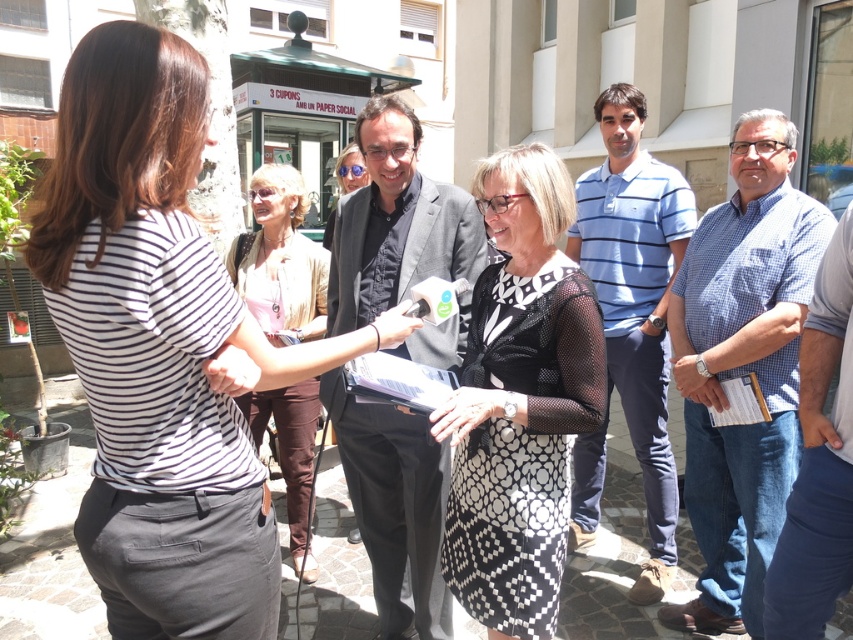
Can you confirm if striped cotton shirt at center is shorter than blue checkered shirt at center?

Yes, striped cotton shirt at center is shorter than blue checkered shirt at center.

The width and height of the screenshot is (853, 640). I want to click on striped cotton shirt at center, so click(x=161, y=348).

The width and height of the screenshot is (853, 640). What do you see at coordinates (161, 348) in the screenshot?
I see `striped cotton shirt at center` at bounding box center [161, 348].

Locate an element on the screen. This screenshot has width=853, height=640. striped cotton shirt at center is located at coordinates (161, 348).

Between black matte suit at center and light pink fabric blouse at center, which one is positioned higher?

Positioned higher is light pink fabric blouse at center.

Who is taller, black matte suit at center or light pink fabric blouse at center?

black matte suit at center is taller.

Is point (363, 509) in front of point (248, 310)?

That is True.

Find the location of a particular element. The height and width of the screenshot is (640, 853). black matte suit at center is located at coordinates (396, 224).

Is point (595, 346) in front of point (593, 472)?

That is True.

Can you confirm if black printed dress at center is taller than blue striped polo shirt at center?

In fact, black printed dress at center may be shorter than blue striped polo shirt at center.

Is point (486, 593) positioned before point (653, 502)?

Yes.

This screenshot has height=640, width=853. Identify the location of black printed dress at center. (519, 401).